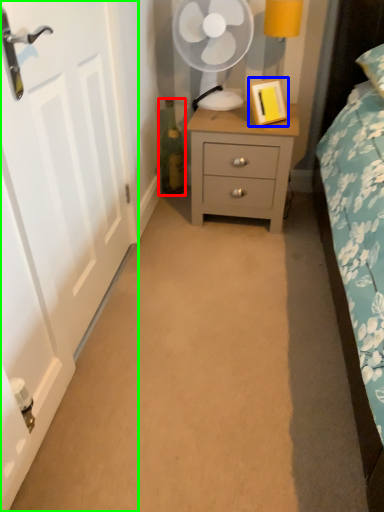
Question: Which is farther away from bottle (highlighted by a red box)? picture frame (highlighted by a blue box) or door (highlighted by a green box)?

Choices:
 (A) picture frame
 (B) door

Answer: (B)